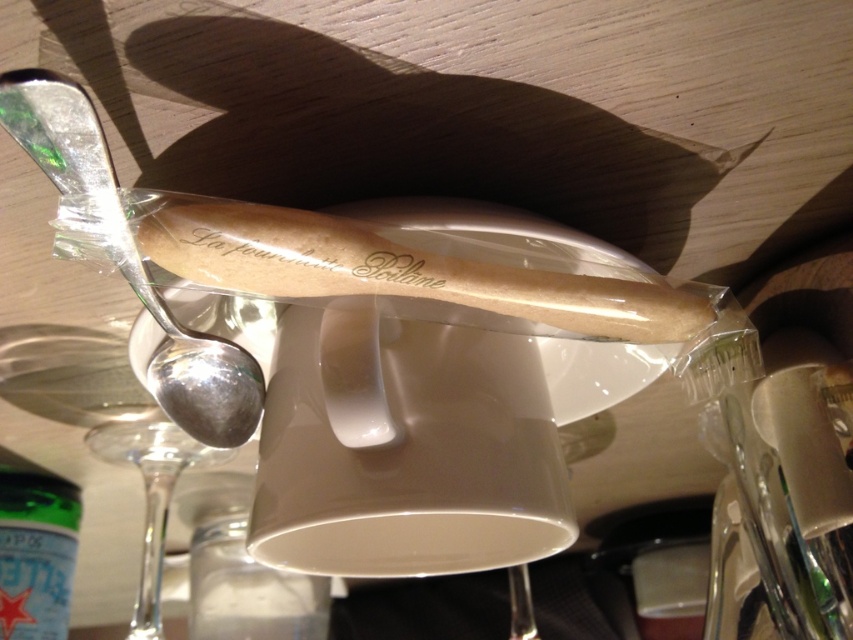
You are setting up a table for a formal dinner and need to arrange the silver polished spoon at upper left and the green matte bottle at lower left. Based on their sizes, which one should be placed in a taller holder to fit properly?

The silver polished spoon at upper left has a greater height compared to the green matte bottle at lower left, so it should be placed in a taller holder to accommodate its size.

You are setting up a table for a dinner party and need to arrange the green matte bottle at lower left and the transparent glass wine glass at lower left. Since both are at the lower left, how can you position them so they don

The transparent glass wine glass at lower left is behind green matte bottle at lower left, so you can place the green matte bottle in front of the transparent glass wine glass to maintain their positions at the lower left.

You are setting up a table for a formal dinner and need to arrange the silver polished spoon at upper left and transparent glass wine glass at lower left. Which object should you place closer to the edge of the table to ensure proper placement according to standard table settings?

The silver polished spoon at upper left should be placed closer to the edge of the table than the transparent glass wine glass at lower left because it is shorter and standard table settings typically position shorter utensils closer to the diner.